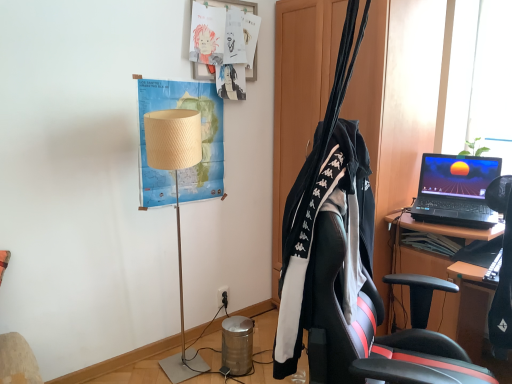
How much space does matte paper posters at upper center, the second poster when ordered from bottom to top, occupy vertically?

matte paper posters at upper center, the second poster when ordered from bottom to top, is 22.30 inches in height.

Locate an element on the screen. black plastic power outlet at lower center is located at coordinates (222, 296).

How different are the orientations of black plastic power outlet at lower center and beige paper map at upper left, the first poster in the bottom-to-top sequence, in degrees?

The angular difference between black plastic power outlet at lower center and beige paper map at upper left, the first poster in the bottom-to-top sequence, is 0.945 degrees.

Does black plastic power outlet at lower center have a smaller size compared to beige paper map at upper left, which ranks as the 2th poster in top-to-bottom order?

Yes.

You are a GUI agent. You are given a task and a screenshot of the screen. Output one action in this format:
    pyautogui.click(x=<x>, y=<y>)
    Task: Click on the power outlet below the beige paper map at upper left, the first poster in the bottom-to-top sequence (from a real-world perspective)
    The image size is (512, 384).
    Given the screenshot: What is the action you would take?
    pyautogui.click(x=222, y=296)

Can you confirm if black plastic power outlet at lower center is taller than beige paper map at upper left, which ranks as the 2th poster in top-to-bottom order?

In fact, black plastic power outlet at lower center may be shorter than beige paper map at upper left, which ranks as the 2th poster in top-to-bottom order.

Choose the correct answer: Is black plastic power outlet at lower center inside matte paper posters at upper center, which is the 1th poster in top-to-bottom order, or outside it?

black plastic power outlet at lower center exists outside the volume of matte paper posters at upper center, which is the 1th poster in top-to-bottom order.

What's the angular difference between black plastic power outlet at lower center and matte paper posters at upper center, the second poster when ordered from bottom to top,'s facing directions?

1.61 degrees.

From a real-world perspective, who is located higher, black plastic power outlet at lower center or matte paper posters at upper center, the second poster when ordered from bottom to top?

In real-world perspective, matte paper posters at upper center, the second poster when ordered from bottom to top, is above.

Find the location of `power outlet below the matte paper posters at upper center, the second poster when ordered from bottom to top (from a real-world perspective)`. power outlet below the matte paper posters at upper center, the second poster when ordered from bottom to top (from a real-world perspective) is located at coordinates (222, 296).

Relative to beige fabric lampshade at center-left, is black plastic power outlet at lower center in front or behind?

Visually, black plastic power outlet at lower center is located behind beige fabric lampshade at center-left.

Are black plastic power outlet at lower center and beige fabric lampshade at center-left beside each other?

No, black plastic power outlet at lower center is not making contact with beige fabric lampshade at center-left.

Is black plastic power outlet at lower center to the left or to the right of beige fabric lampshade at center-left in the image?

In the image, black plastic power outlet at lower center appears on the right side of beige fabric lampshade at center-left.

Is matte paper posters at upper center, which is the 1th poster in top-to-bottom order, oriented towards beige fabric lampshade at center-left?

No, matte paper posters at upper center, which is the 1th poster in top-to-bottom order, is not oriented towards beige fabric lampshade at center-left.

Which object is further away from the camera, matte paper posters at upper center, the second poster when ordered from bottom to top, or beige fabric lampshade at center-left?

Positioned behind is matte paper posters at upper center, the second poster when ordered from bottom to top.

Is matte paper posters at upper center, which is the 1th poster in top-to-bottom order, at the left side of beige fabric lampshade at center-left?

In fact, matte paper posters at upper center, which is the 1th poster in top-to-bottom order, is to the right of beige fabric lampshade at center-left.

What's the angular difference between beige fabric lampshade at center-left and beige paper map at upper left, which ranks as the 2th poster in top-to-bottom order,'s facing directions?

They differ by 1.25 degrees in their facing directions.

Looking at the image, does beige fabric lampshade at center-left seem bigger or smaller compared to beige paper map at upper left, the first poster in the bottom-to-top sequence?

In the image, beige fabric lampshade at center-left appears to be larger than beige paper map at upper left, the first poster in the bottom-to-top sequence.

In the image, is beige fabric lampshade at center-left on the left side or the right side of beige paper map at upper left, the first poster in the bottom-to-top sequence?

From the image, it's evident that beige fabric lampshade at center-left is to the right of beige paper map at upper left, the first poster in the bottom-to-top sequence.

Between beige fabric lampshade at center-left and beige paper map at upper left, which ranks as the 2th poster in top-to-bottom order, which one has smaller width?

With smaller width is beige paper map at upper left, which ranks as the 2th poster in top-to-bottom order.

Is matte paper posters at upper center, which is the 1th poster in top-to-bottom order, looking in the opposite direction of black plastic power outlet at lower center?

That's not correct — matte paper posters at upper center, which is the 1th poster in top-to-bottom order, is not looking away from black plastic power outlet at lower center.

Who is bigger, matte paper posters at upper center, the second poster when ordered from bottom to top, or black plastic power outlet at lower center?

matte paper posters at upper center, the second poster when ordered from bottom to top.

Find the location of a particular element. power outlet directly beneath the matte paper posters at upper center, which is the 1th poster in top-to-bottom order (from a real-world perspective) is located at coordinates (222, 296).

Considering the positions of point (198, 66) and point (224, 287), is point (198, 66) closer or farther from the camera than point (224, 287)?

Point (198, 66) is positioned closer to the camera compared to point (224, 287).

From the image's perspective, which is below, black fabric clothesline at center or beige fabric lampshade at center-left?

beige fabric lampshade at center-left appears lower in the image.

Considering the points (365, 177) and (194, 110), which point is in front, point (365, 177) or point (194, 110)?

Positioned in front is point (365, 177).

Is black fabric clothesline at center oriented towards beige fabric lampshade at center-left?

No, black fabric clothesline at center is not turned towards beige fabric lampshade at center-left.

The width and height of the screenshot is (512, 384). Find the location of `power outlet behind the beige paper map at upper left, the first poster in the bottom-to-top sequence`. power outlet behind the beige paper map at upper left, the first poster in the bottom-to-top sequence is located at coordinates (222, 296).

The width and height of the screenshot is (512, 384). I want to click on power outlet lying on the left of matte paper posters at upper center, which is the 1th poster in top-to-bottom order, so click(x=222, y=296).

Which object lies further to the anchor point beige fabric lampshade at center-left, black plastic power outlet at lower center or black fabric clothesline at center?

Among the two, black plastic power outlet at lower center is located further to beige fabric lampshade at center-left.

Looking at the image, which one is located further to beige fabric lampshade at center-left, black fabric clothesline at center or matte paper posters at upper center, which is the 1th poster in top-to-bottom order?

black fabric clothesline at center is further to beige fabric lampshade at center-left.

Based on their spatial positions, is beige paper map at upper left, the first poster in the bottom-to-top sequence, or black fabric clothesline at center closer to matte paper posters at upper center, which is the 1th poster in top-to-bottom order?

Based on the image, beige paper map at upper left, the first poster in the bottom-to-top sequence, appears to be nearer to matte paper posters at upper center, which is the 1th poster in top-to-bottom order.

In the scene shown: Considering their positions, is beige fabric lampshade at center-left positioned further to beige paper map at upper left, which ranks as the 2th poster in top-to-bottom order, than black plastic power outlet at lower center?

black plastic power outlet at lower center.

Which object lies further to the anchor point matte paper posters at upper center, which is the 1th poster in top-to-bottom order, beige paper map at upper left, the first poster in the bottom-to-top sequence, or black plastic power outlet at lower center?

black plastic power outlet at lower center lies further to matte paper posters at upper center, which is the 1th poster in top-to-bottom order, than the other object.

Estimate the real-world distances between objects in this image. Which object is closer to beige fabric lampshade at center-left, black fabric clothesline at center or beige paper map at upper left, which ranks as the 2th poster in top-to-bottom order?

beige paper map at upper left, which ranks as the 2th poster in top-to-bottom order.

Based on their spatial positions, is black plastic power outlet at lower center or beige paper map at upper left, which ranks as the 2th poster in top-to-bottom order, closer to matte paper posters at upper center, the second poster when ordered from bottom to top?

beige paper map at upper left, which ranks as the 2th poster in top-to-bottom order.

Considering their positions, is matte paper posters at upper center, the second poster when ordered from bottom to top, positioned further to black plastic power outlet at lower center than beige fabric lampshade at center-left?

The object further to black plastic power outlet at lower center is matte paper posters at upper center, the second poster when ordered from bottom to top.

Identify the location of poster that lies between matte paper posters at upper center, which is the 1th poster in top-to-bottom order, and beige fabric lampshade at center-left from top to bottom. (201, 138).

At what (x,y) coordinates should I click in order to perform the action: click on lamp between black fabric clothesline at center and beige paper map at upper left, which ranks as the 2th poster in top-to-bottom order, along the z-axis. Please return your answer as a coordinate pair (x, y). This screenshot has width=512, height=384. Looking at the image, I should click on (176, 203).

You are a GUI agent. You are given a task and a screenshot of the screen. Output one action in this format:
    pyautogui.click(x=<x>, y=<y>)
    Task: Click on the poster between matte paper posters at upper center, the second poster when ordered from bottom to top, and black plastic power outlet at lower center, in the vertical direction
    This screenshot has width=512, height=384.
    Given the screenshot: What is the action you would take?
    pyautogui.click(x=201, y=138)

At what (x,y) coordinates should I click in order to perform the action: click on lamp located between black fabric clothesline at center and matte paper posters at upper center, the second poster when ordered from bottom to top, in the depth direction. Please return your answer as a coordinate pair (x, y). This screenshot has height=384, width=512. Looking at the image, I should click on (176, 203).